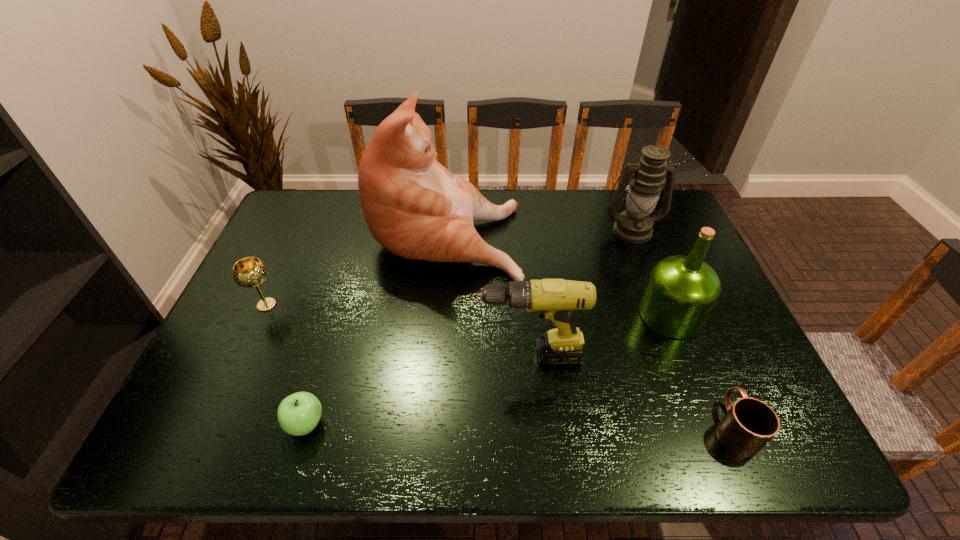
In the image, there is a desktop. Identify the location of vacant space at the near edge. (684, 456).

Identify the location of free space at the right edge of the desktop. Image resolution: width=960 pixels, height=540 pixels. (680, 250).

Identify the location of vacant point located between the chalice and the oil lamp. This screenshot has width=960, height=540. (449, 267).

I want to click on free spot between the apple and the oil lamp, so 468,327.

Identify the location of free space between the mug and the apple. The width and height of the screenshot is (960, 540). (520, 425).

Identify the location of empty space between the olive oil and the leftmost object. (468, 310).

In order to click on unoccupied area between the third nearest object and the chalice in this screenshot , I will do `click(397, 330)`.

This screenshot has width=960, height=540. Identify the location of free space between the oil lamp and the apple. (468, 327).

Locate an element on the screen. The height and width of the screenshot is (540, 960). free spot between the leftmost object and the oil lamp is located at coordinates (449, 267).

At what (x,y) coordinates should I click in order to perform the action: click on free space between the oil lamp and the chalice. Please return your answer as a coordinate pair (x, y). The width and height of the screenshot is (960, 540). Looking at the image, I should click on (449, 267).